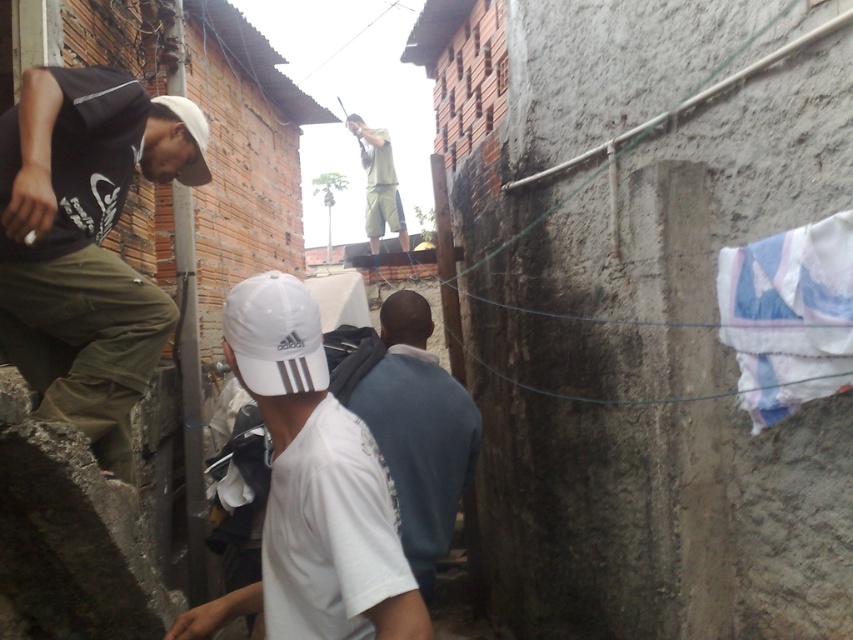
You are a delivery person trying to navigate through the narrow alleyway. You notice the blue cotton cloth at right and the white matte baseball cap at upper left. Which object is bigger in size?

The blue cotton cloth at right is larger in size compared to the white matte baseball cap at upper left according to the description.

You are standing in the alleyway and see the matte black shirt at left and the white matte baseball cap at upper left. Which object is positioned more to the left side of the alleyway?

The matte black shirt at left is positioned more to the left side of the alleyway than the white matte baseball cap at upper left.

What is the color of the shirt at the point specified by coordinates (85, 243)?

The point (85, 243) is on matte black shirt at left.